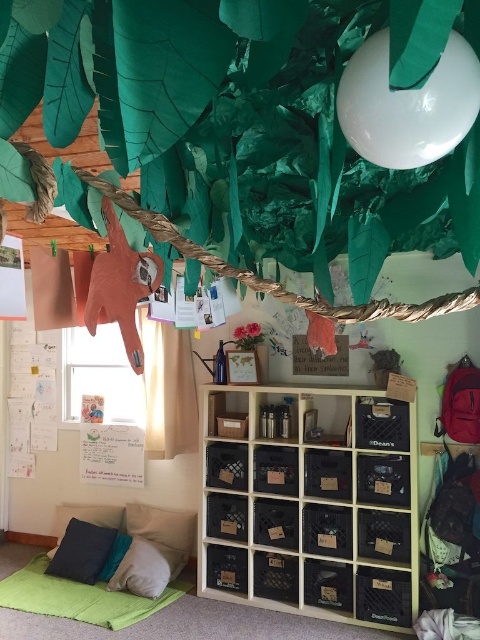
You are sitting on the floor in the cozy indoor space and want to reach the velvety blue pillow at lower left. There is a dark gray cushion at lower left in your way. Can you move the cushion to access the pillow?

The dark gray cushion at lower left is in front of the velvety blue pillow at lower left, so you can move the cushion to access the pillow.

You are sitting on a chair in the room and want to place a 30 cm wide book between the dark gray cushion at lower left and the white soft pillow at lower left. Is there enough space between them to fit the book?

The distance between the dark gray cushion at lower left and the white soft pillow at lower left is 31.38 centimeters. Since the book is 30 cm wide, there is enough space to fit it between them.

You are sitting on the floor in the cozy indoor space and want to reach the dark gray cushion at lower left. Based on its coordinates, can you estimate its position relative to the room?

The dark gray cushion at lower left is located at point coordinates, so it is positioned near the lower left corner of the room.